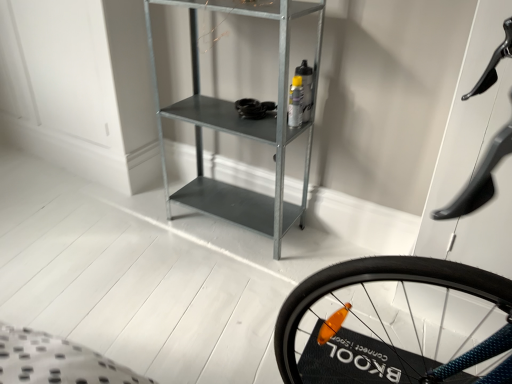
Where is `metallic gray shelf at center`? The height and width of the screenshot is (384, 512). metallic gray shelf at center is located at coordinates (241, 125).

Image resolution: width=512 pixels, height=384 pixels. What do you see at coordinates (241, 125) in the screenshot?
I see `metallic gray shelf at center` at bounding box center [241, 125].

The height and width of the screenshot is (384, 512). I want to click on metallic gray shelf at center, so click(x=241, y=125).